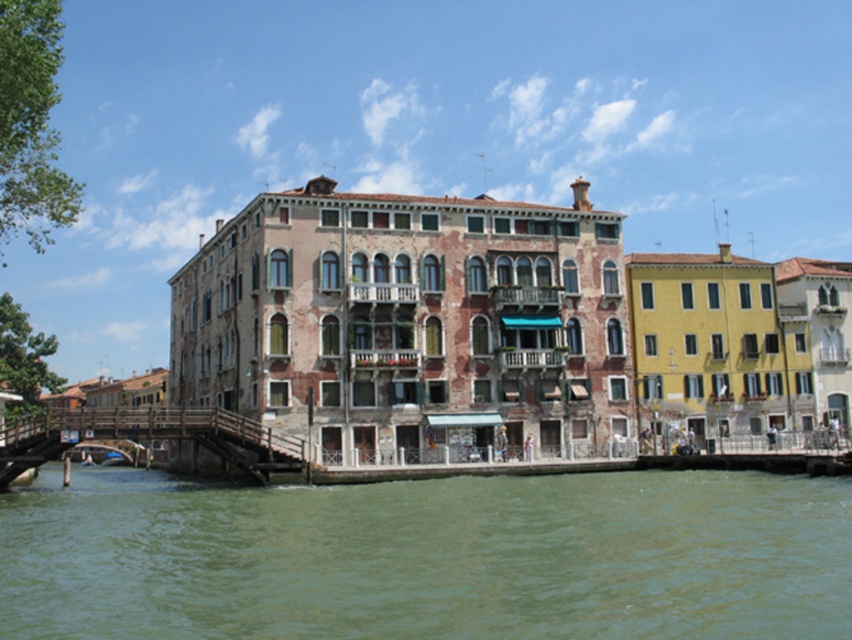
Does green water at lower center appear on the left side of wooden bridge at lower left?

No, green water at lower center is not to the left of wooden bridge at lower left.

Which of these two, green water at lower center or wooden bridge at lower left, stands taller?

With more height is wooden bridge at lower left.

Is point (235, 538) positioned after point (4, 444)?

No.

Where is `green water at lower center`? The width and height of the screenshot is (852, 640). green water at lower center is located at coordinates (429, 556).